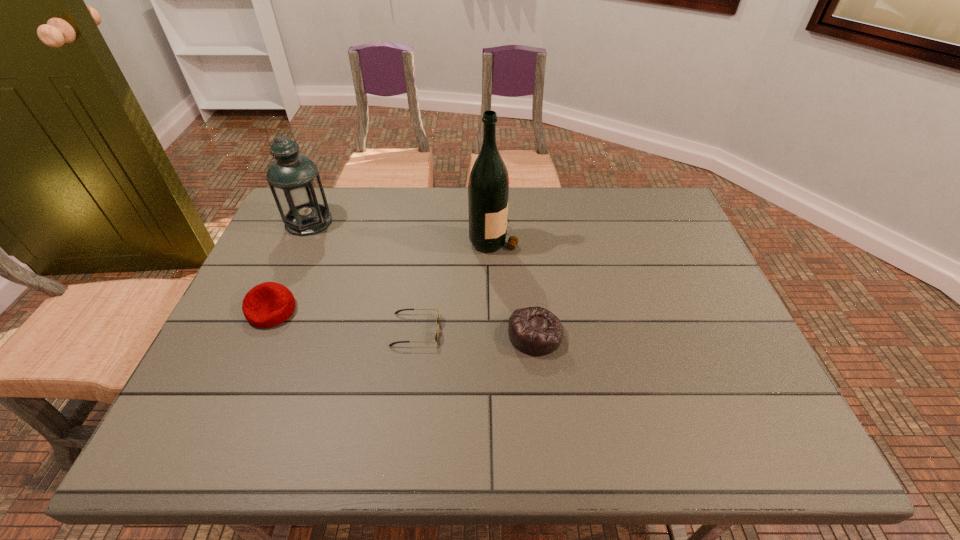
The width and height of the screenshot is (960, 540). In order to click on wine bottle in this screenshot , I will do `click(488, 188)`.

The image size is (960, 540). What are the coordinates of `the fourth shortest object` in the screenshot? It's located at (294, 180).

In order to click on the left beanbag in this screenshot , I will do `click(268, 304)`.

Locate an element on the screen. The image size is (960, 540). the right beanbag is located at coordinates (535, 331).

This screenshot has width=960, height=540. Identify the location of sunglasses. (437, 321).

This screenshot has width=960, height=540. Identify the location of the shortest object. (437, 321).

Image resolution: width=960 pixels, height=540 pixels. In order to click on vacant space located 0.360m on the right of the wine bottle in this screenshot , I will do `click(638, 238)`.

Find the location of `free space located on the front of the second tallest object`. free space located on the front of the second tallest object is located at coordinates (278, 290).

At what (x,y) coordinates should I click in order to perform the action: click on vacant region located 0.300m on the seat area of the left beanbag. Please return your answer as a coordinate pair (x, y). This screenshot has height=540, width=960. Looking at the image, I should click on pos(210,450).

This screenshot has height=540, width=960. Identify the location of free space located on the left of the right beanbag. pyautogui.click(x=375, y=334).